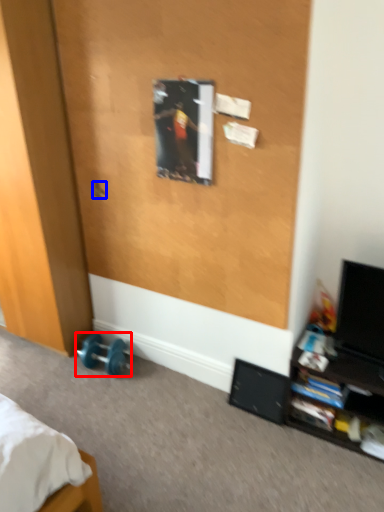
Question: Which object appears farthest to the camera in this image, dumbbell (highlighted by a red box) or door handle (highlighted by a blue box)?

Choices:
 (A) dumbbell
 (B) door handle

Answer: (A)